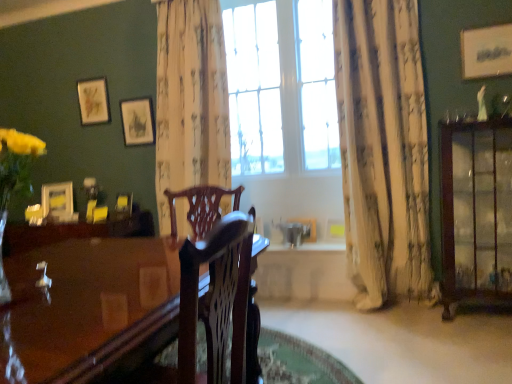
Where is `unoccupied area in front of brown wood cabinet at right`? The width and height of the screenshot is (512, 384). unoccupied area in front of brown wood cabinet at right is located at coordinates (483, 339).